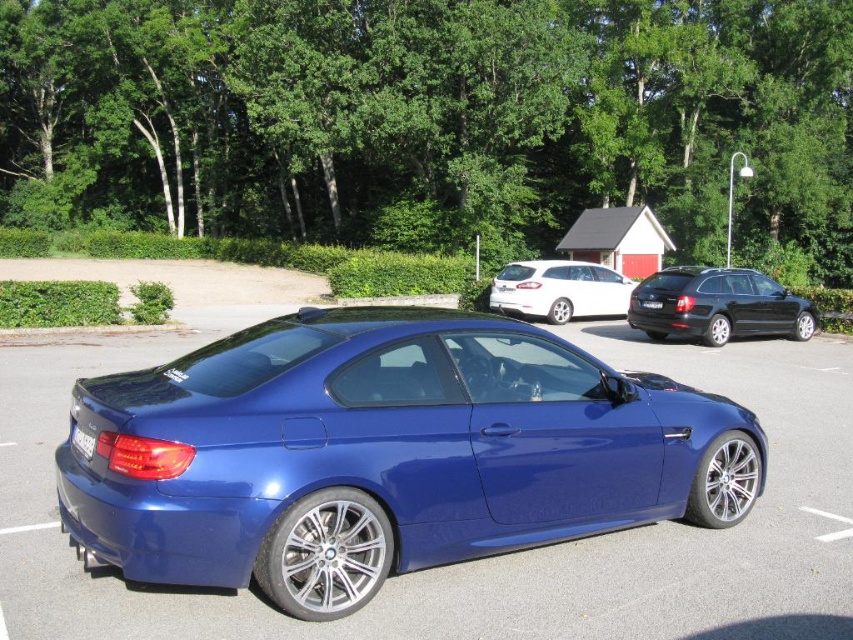
Consider the image. Does white matte wagon at center have a smaller size compared to black plastic license plate at rear?

No, white matte wagon at center is not smaller than black plastic license plate at rear.

Locate an element on the screen. Image resolution: width=853 pixels, height=640 pixels. white matte wagon at center is located at coordinates (560, 289).

Image resolution: width=853 pixels, height=640 pixels. In order to click on white matte wagon at center in this screenshot , I will do `click(560, 289)`.

This screenshot has width=853, height=640. Describe the element at coordinates (386, 452) in the screenshot. I see `metallic blue car at center` at that location.

Is point (546, 381) behind point (80, 442)?

Yes.

I want to click on metallic blue car at center, so click(x=386, y=452).

Is point (724, 276) behind point (71, 435)?

Yes, it is.

Measure the distance between black metallic wagon at right and black plastic license plate at rear.

They are 46.40 feet apart.

The height and width of the screenshot is (640, 853). Describe the element at coordinates (718, 305) in the screenshot. I see `black metallic wagon at right` at that location.

The image size is (853, 640). Find the location of `black metallic wagon at right`. black metallic wagon at right is located at coordinates 718,305.